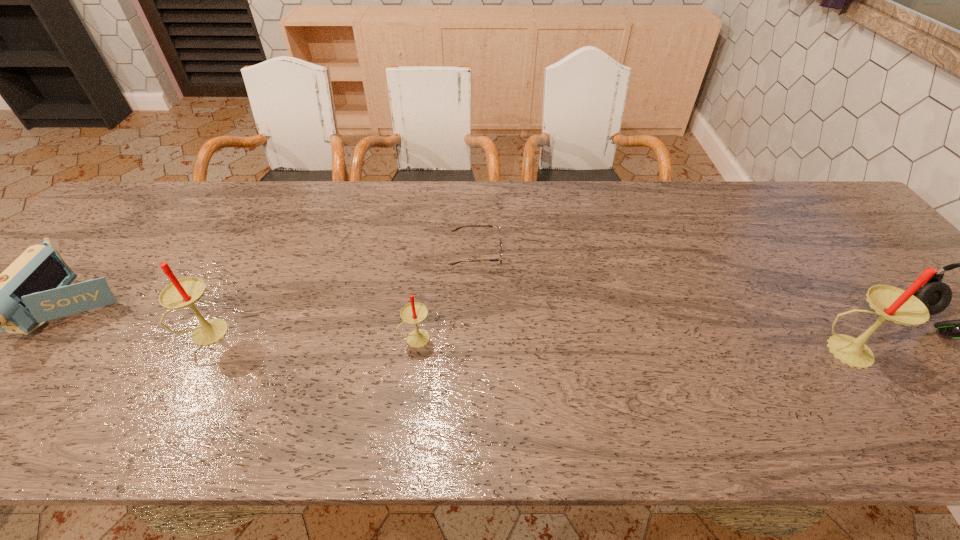
Locate an element on the screen. vacant area situated on the front-facing side of the third object from right to left is located at coordinates (613, 253).

Identify the location of object situated at the near edge. The image size is (960, 540). (891, 303).

In the image, there is a desktop. Identify the location of free space at the far edge. (373, 197).

Where is `free location at the near edge`? Image resolution: width=960 pixels, height=540 pixels. free location at the near edge is located at coordinates (64, 386).

This screenshot has height=540, width=960. What are the coordinates of `free space at the left edge of the desktop` in the screenshot? It's located at (3, 343).

In order to click on free space between the second object from right to left and the shortest object in this screenshot , I will do click(x=660, y=302).

What are the coordinates of `vacant area that lies between the spectacles and the second candle from right to left` in the screenshot? It's located at (445, 296).

Locate an element on the screen. The width and height of the screenshot is (960, 540). empty space between the third object from right to left and the second object from left to right is located at coordinates (343, 293).

Select which object is the fourth closest to the farthest object. Please provide its 2D coordinates. Your answer should be formatted as a tuple, i.e. [(x, y)], where the tuple contains the x and y coordinates of a point satisfying the conditions above.

[(35, 288)]

You are a GUI agent. You are given a task and a screenshot of the screen. Output one action in this format:
    pyautogui.click(x=<x>, y=<y>)
    Task: Click on the object that is the third closest one to the fifth shortest object
    The height and width of the screenshot is (540, 960).
    Given the screenshot: What is the action you would take?
    pyautogui.click(x=500, y=245)